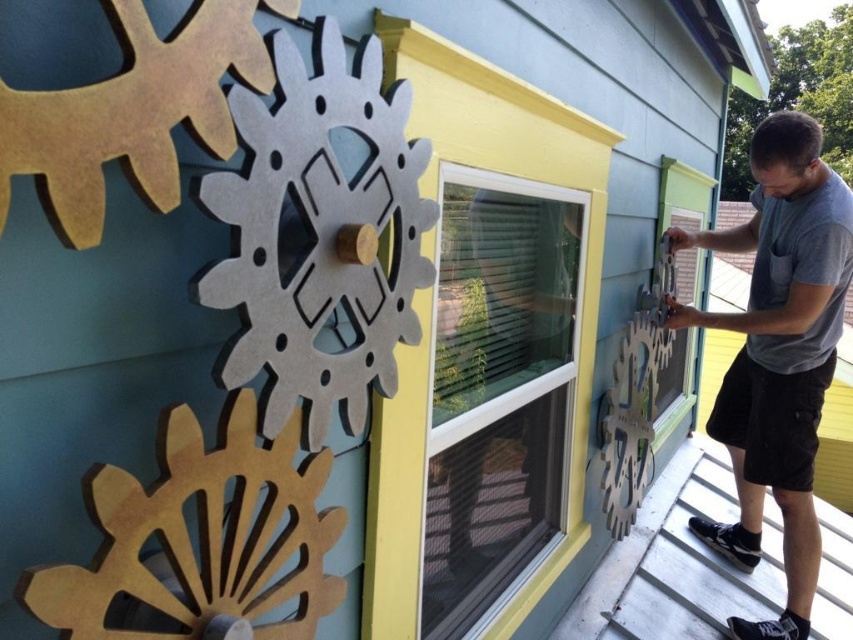
Question: Is yellow plastic window at center below gray cotton shirt at right?

Choices:
 (A) yes
 (B) no

Answer: (A)

Question: Which point is farther to the camera?

Choices:
 (A) gray cotton shirt at right
 (B) yellow plastic window at center

Answer: (A)

Question: Which point is farther from the camera taking this photo?

Choices:
 (A) (740, 637)
 (B) (456, 256)

Answer: (A)

Question: Is yellow plastic window at center to the right of gray cotton shirt at right from the viewer's perspective?

Choices:
 (A) yes
 (B) no

Answer: (B)

Question: Is yellow plastic window at center behind gray cotton shirt at right?

Choices:
 (A) yes
 (B) no

Answer: (B)